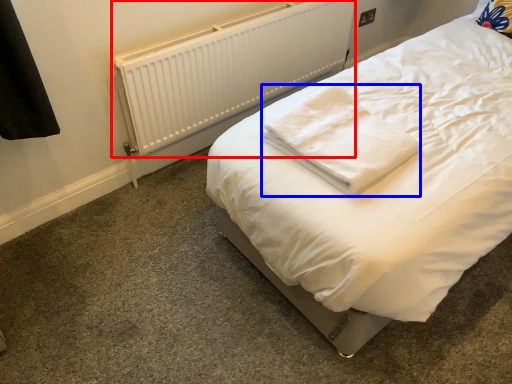
Question: Which object appears farthest to the camera in this image, radiator (highlighted by a red box) or cloth (highlighted by a blue box)?

Choices:
 (A) radiator
 (B) cloth

Answer: (A)